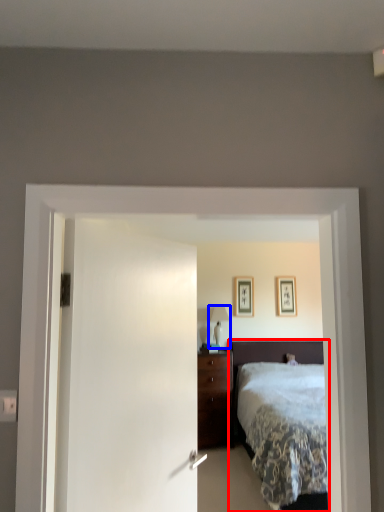
Question: Which object is closer to the camera taking this photo, bed (highlighted by a red box) or table lamp (highlighted by a blue box)?

Choices:
 (A) bed
 (B) table lamp

Answer: (A)